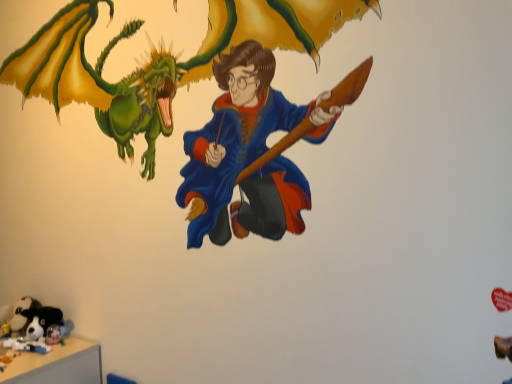
Question: Can you confirm if soft plush toy at bottom left is positioned to the right of soft plush toy at lower left?

Choices:
 (A) yes
 (B) no

Answer: (A)

Question: From a real-world perspective, is soft plush toy at bottom left beneath soft plush toy at lower left?

Choices:
 (A) no
 (B) yes

Answer: (A)

Question: Does soft plush toy at bottom left have a lesser width compared to soft plush toy at lower left?

Choices:
 (A) no
 (B) yes

Answer: (A)

Question: Could you tell me if soft plush toy at bottom left is facing soft plush toy at lower left?

Choices:
 (A) yes
 (B) no

Answer: (B)

Question: Is soft plush toy at bottom left bigger than soft plush toy at lower left?

Choices:
 (A) yes
 (B) no

Answer: (A)

Question: From the image's perspective, is soft plush toy at bottom left below soft plush toy at lower left?

Choices:
 (A) yes
 (B) no

Answer: (B)

Question: Does soft plush toy at lower left appear on the right side of soft plush toy at bottom left?

Choices:
 (A) no
 (B) yes

Answer: (A)

Question: From the image's perspective, is soft plush toy at lower left under soft plush toy at bottom left?

Choices:
 (A) yes
 (B) no

Answer: (A)

Question: Is soft plush toy at lower left taller than soft plush toy at bottom left?

Choices:
 (A) yes
 (B) no

Answer: (B)

Question: From a real-world perspective, is soft plush toy at lower left located beneath soft plush toy at bottom left?

Choices:
 (A) yes
 (B) no

Answer: (A)

Question: Considering the relative sizes of soft plush toy at lower left and soft plush toy at bottom left in the image provided, is soft plush toy at lower left thinner than soft plush toy at bottom left?

Choices:
 (A) no
 (B) yes

Answer: (B)

Question: Is soft plush toy at lower left turned away from soft plush toy at bottom left?

Choices:
 (A) yes
 (B) no

Answer: (B)

Question: Looking at their shapes, would you say soft plush toy at lower left is wider or thinner than soft plush toy at bottom left?

Choices:
 (A) thin
 (B) wide

Answer: (A)